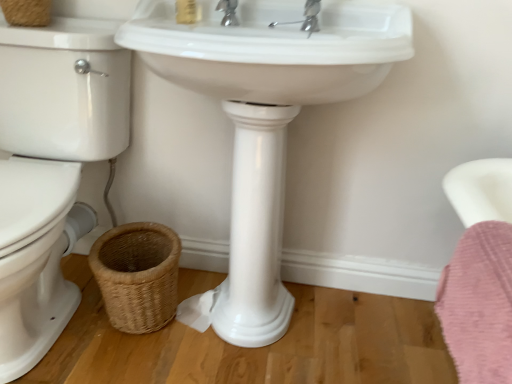
You are a GUI agent. You are given a task and a screenshot of the screen. Output one action in this format:
    pyautogui.click(x=<x>, y=<y>)
    Task: Click on the free region under white glossy sink at center (from a real-world perspective)
    The image size is (512, 384).
    Given the screenshot: What is the action you would take?
    pyautogui.click(x=244, y=341)